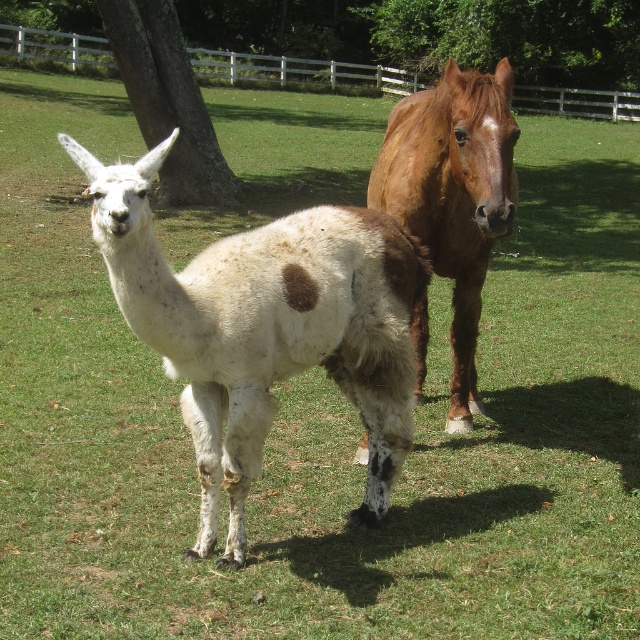
Between point (387, 348) and point (628, 112), which one is positioned behind?

Positioned behind is point (628, 112).

What do you see at coordinates (266, 326) in the screenshot? This screenshot has height=640, width=640. I see `white woolly alpaca at center` at bounding box center [266, 326].

Who is more distant from viewer, (244, 333) or (404, 49)?

The point (404, 49) is more distant.

This screenshot has height=640, width=640. I want to click on white woolly alpaca at center, so click(x=266, y=326).

Can you confirm if white woolly alpaca at center is wider than brown rough tree at upper left?

No, white woolly alpaca at center is not wider than brown rough tree at upper left.

Does white woolly alpaca at center have a lesser width compared to brown rough tree at upper left?

Yes, white woolly alpaca at center is thinner than brown rough tree at upper left.

Between point (378, 276) and point (172, 172), which one is positioned behind?

Point (172, 172)

Image resolution: width=640 pixels, height=640 pixels. What are the coordinates of `white woolly alpaca at center` in the screenshot? It's located at (266, 326).

Is point (92, 220) more distant than point (497, 104)?

Yes, point (92, 220) is behind point (497, 104).

Who is lower down, white woolly alpaca at center or brown glossy horse at center?

white woolly alpaca at center is below.

Is point (131, 266) positioned behind point (476, 282)?

That is False.

Locate an element on the screen. Image resolution: width=640 pixels, height=640 pixels. white woolly alpaca at center is located at coordinates (266, 326).